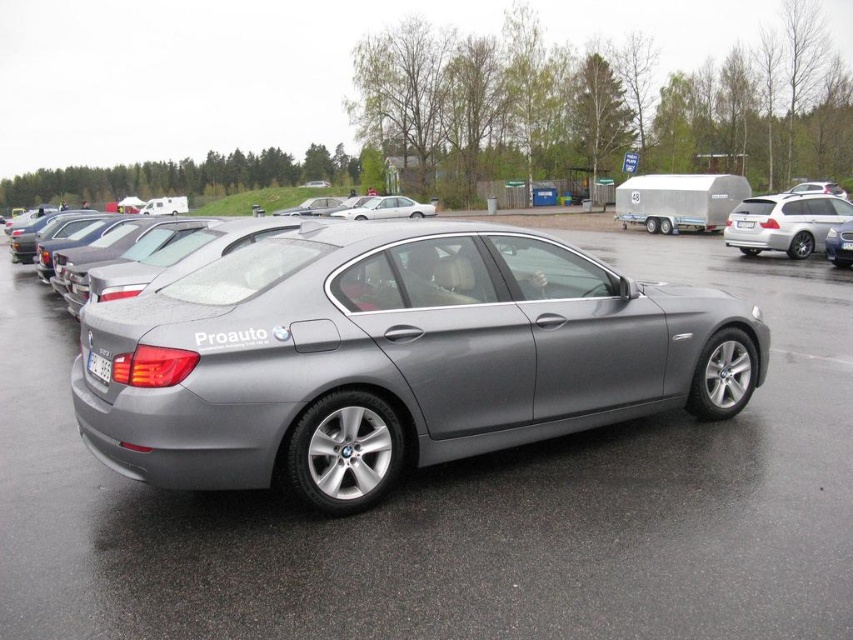
Between point (433, 209) and point (323, 209), which one is positioned in front?

Positioned in front is point (323, 209).

Consider the image. Is white glossy sedan at center wider than silver metallic sedan at center?

No, white glossy sedan at center is not wider than silver metallic sedan at center.

Does point (379, 208) come closer to viewer compared to point (317, 209)?

Yes, it is.

The height and width of the screenshot is (640, 853). I want to click on white glossy sedan at center, so 386,209.

Between silver metallic sedan at center and white plastic license plate at center, which one has less height?

With less height is white plastic license plate at center.

Measure the distance between silver metallic sedan at center and white plastic license plate at center.

silver metallic sedan at center is 104.79 feet from white plastic license plate at center.

Does point (300, 205) lie in front of point (753, 221)?

No, (300, 205) is behind (753, 221).

Identify the location of silver metallic sedan at center. The height and width of the screenshot is (640, 853). (312, 205).

In the scene shown: Is satin metallic car at center positioned behind white plastic license plate at rear?

No.

Can you confirm if satin metallic car at center is positioned below white plastic license plate at rear?

No, satin metallic car at center is not below white plastic license plate at rear.

Is point (718, 470) less distant than point (108, 369)?

No.

I want to click on satin metallic car at center, so click(x=463, y=508).